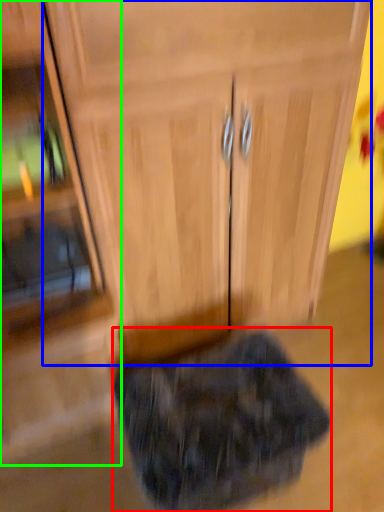
Question: Which object is positioned farthest from animal (highlighted by a red box)? Select from cabinetry (highlighted by a blue box) and side cabinet (highlighted by a green box).

Choices:
 (A) cabinetry
 (B) side cabinet

Answer: (A)